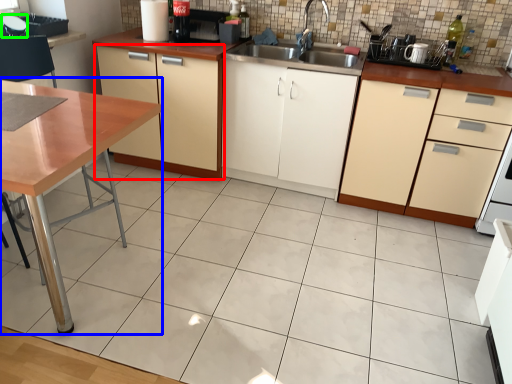
Question: Based on their relative distances, which object is farther from cabinetry (highlighted by a red box)? Choose from table (highlighted by a blue box) and appliance (highlighted by a green box).

Choices:
 (A) table
 (B) appliance

Answer: (A)